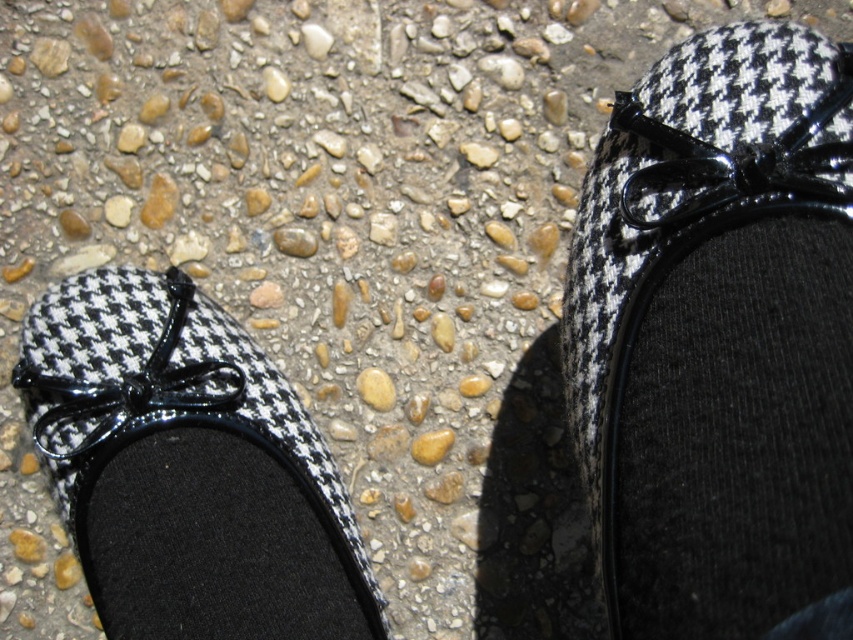
In the scene shown: Does houndstooth fabric shoe at upper right appear on the left side of houndstooth fabric shoe at lower left?

Incorrect, houndstooth fabric shoe at upper right is not on the left side of houndstooth fabric shoe at lower left.

Which is behind, point (634, 579) or point (286, 454)?

The point (286, 454) is behind.

I want to click on houndstooth fabric shoe at upper right, so click(x=718, y=339).